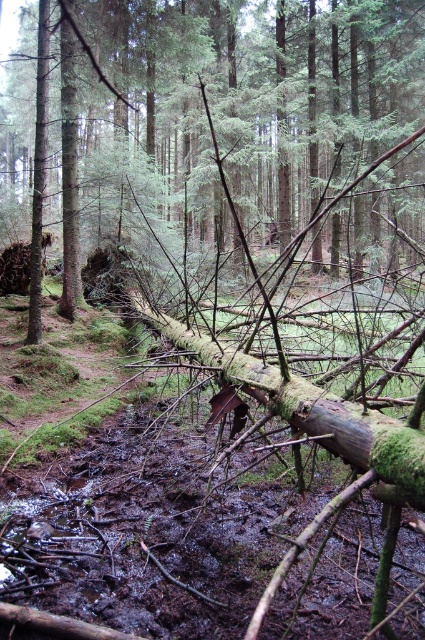
You are a hiker who needs to cross the forest floor. You see two logs, the green mossy log at center and the muddy wet log at center. How far apart are they?

The distance between the green mossy log at center and the muddy wet log at center is 30.38 feet.

You are a hiker who wants to cross the forest floor. You see two logs at the center of the image, the green mossy log at center and the muddy wet log at center. Which log should you step on first to reach the other side?

You should step on the green mossy log at center first because it is closer to the viewer than the muddy wet log at center, allowing you to reach it more easily.

You are a hiker trying to cross the forest floor. You see a green mossy log at center and a muddy wet log at center. Which log is bigger in size?

The green mossy log at center is larger in size compared to the muddy wet log at center.